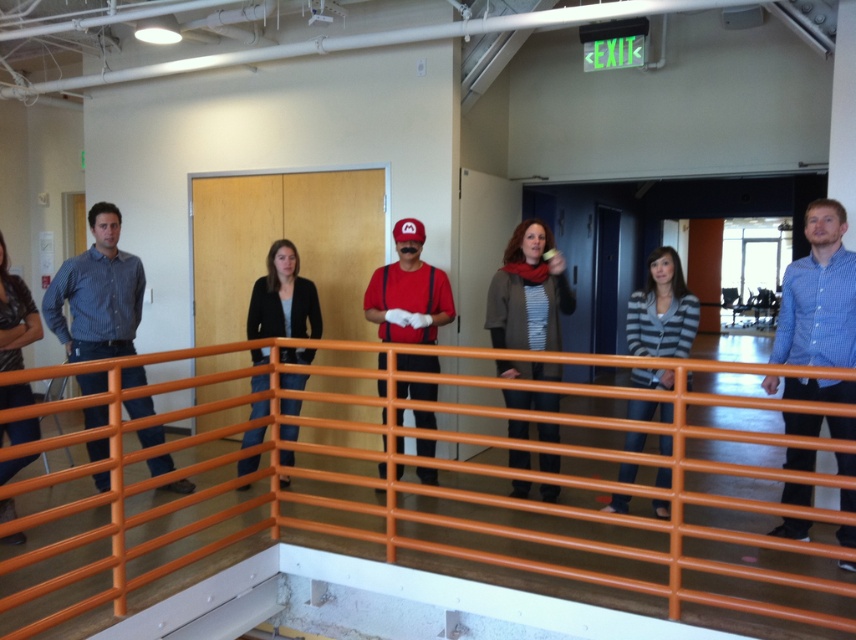
Question: Is the position of striped sweater at center more distant than that of matte red shirt at center?

Choices:
 (A) yes
 (B) no

Answer: (B)

Question: Which of these objects is positioned farthest from the striped knit cardigan at center?

Choices:
 (A) striped sweater at center
 (B) blue denim jeans at left

Answer: (B)

Question: Which object appears farthest from the camera in this image?

Choices:
 (A) orange plastic rail at center
 (B) striped knit cardigan at center
 (C) striped sweater at center

Answer: (C)

Question: Does striped sweater at center have a greater width compared to black matte jacket at center?

Choices:
 (A) no
 (B) yes

Answer: (A)

Question: Can you confirm if matte red shirt at center is smaller than blue denim jeans at left?

Choices:
 (A) yes
 (B) no

Answer: (A)

Question: Which of the following is the farthest from the observer?

Choices:
 (A) (539, 300)
 (B) (627, 310)
 (C) (21, 324)
 (D) (845, 388)

Answer: (A)